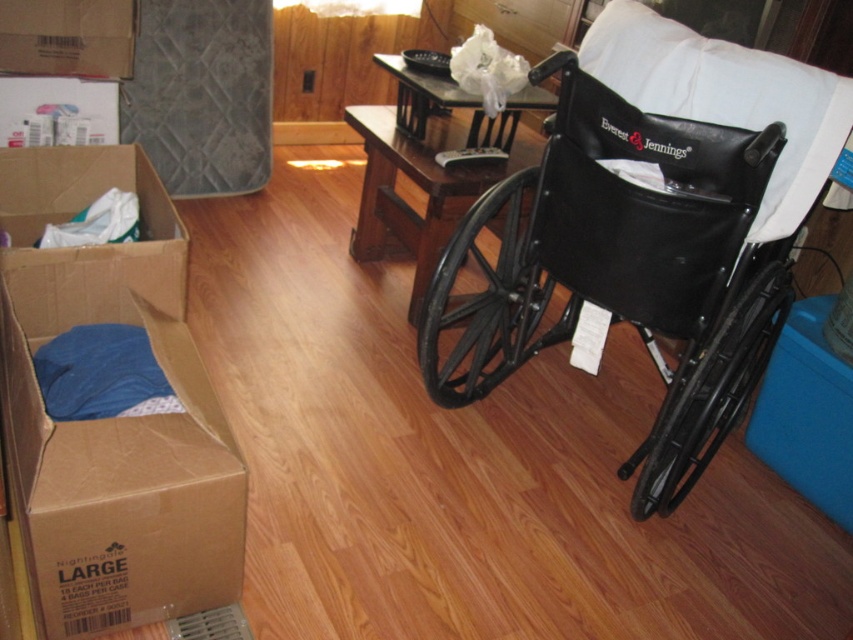
Is black plastic wheelchair at right thinner than brown cardboard box at upper left?

Incorrect, black plastic wheelchair at right's width is not less than brown cardboard box at upper left's.

Looking at this image, does black plastic wheelchair at right appear over brown cardboard box at upper left?

No, black plastic wheelchair at right is not above brown cardboard box at upper left.

Who is more distant from viewer, (505, 330) or (6, 67)?

Point (6, 67)

Locate an element on the screen. black plastic wheelchair at right is located at coordinates (627, 266).

Between point (262, 154) and point (20, 54), which one is positioned behind?

The point (262, 154) is more distant.

Is point (198, 84) closer to camera compared to point (88, 22)?

No, (198, 84) is behind (88, 22).

Who is more distant from viewer, [148,96] or [50,42]?

The point [148,96] is behind.

The height and width of the screenshot is (640, 853). What are the coordinates of `dark gray quilted mattress at left` in the screenshot? It's located at click(x=202, y=93).

Does black plastic wheelchair at right have a smaller size compared to dark gray quilted mattress at left?

No.

Can you confirm if black plastic wheelchair at right is positioned to the left of dark gray quilted mattress at left?

In fact, black plastic wheelchair at right is to the right of dark gray quilted mattress at left.

Does point (550, 140) come in front of point (125, 90)?

That is True.

I want to click on black plastic wheelchair at right, so click(x=627, y=266).